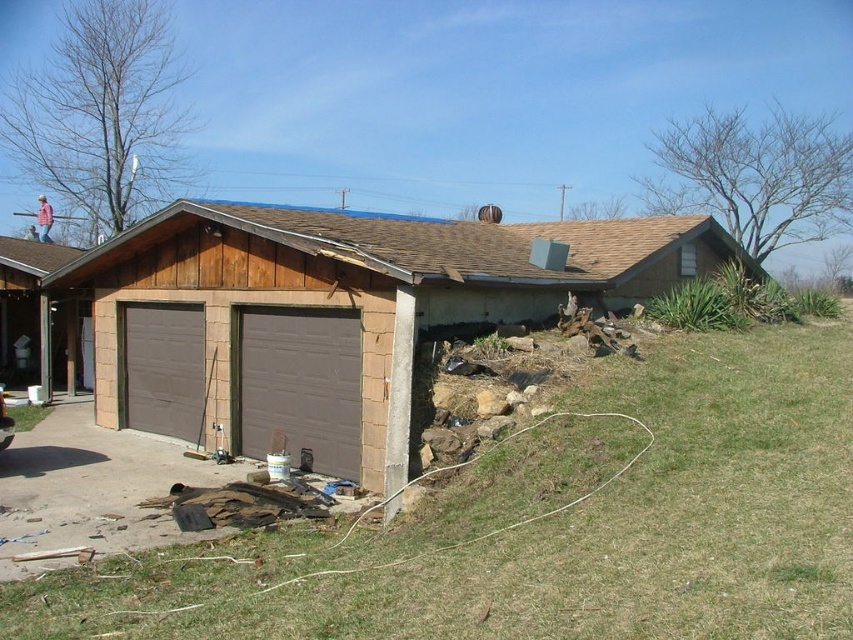
Who is more distant from viewer, (367, 230) or (341, 417)?

Positioned behind is point (367, 230).

Looking at this image, can you confirm if brown wood shed at center is positioned to the right of brown matte garage door at center?

Correct, you'll find brown wood shed at center to the right of brown matte garage door at center.

Which is in front, point (320, 305) or point (358, 456)?

Point (358, 456) is more forward.

This screenshot has height=640, width=853. Identify the location of brown wood shed at center. (335, 314).

Looking at this image, is brown wood shed at center behind brown matte garage door at left?

No, brown wood shed at center is closer to the viewer.

Who is taller, brown wood shed at center or brown matte garage door at left?

brown wood shed at center

Is point (286, 355) positioned in front of point (154, 380)?

Yes, point (286, 355) is in front of point (154, 380).

Locate an element on the screen. The image size is (853, 640). brown wood shed at center is located at coordinates (335, 314).

Consider the image. Is brown concrete driveway at lower left smaller than brown matte garage door at center?

Yes, brown concrete driveway at lower left is smaller than brown matte garage door at center.

Looking at this image, does brown concrete driveway at lower left have a greater height compared to brown matte garage door at center?

No, brown concrete driveway at lower left is not taller than brown matte garage door at center.

Is point (77, 508) positioned before point (347, 321)?

That is True.

This screenshot has height=640, width=853. I want to click on brown concrete driveway at lower left, so click(91, 490).